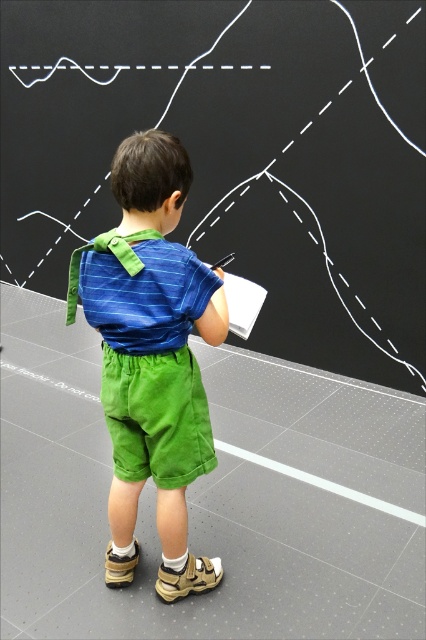
You are observing a classroom scene where two children are near the blackboard. You notice a blue striped shirt at center and a blue striped shirt at back. Which child is closer to you?

The blue striped shirt at center is closer to you because it has a larger size compared to the blue striped shirt at back, indicating it is nearer in the scene.

You are a teacher observing the child drawing on the blackboard. You notice two points marked on the board at coordinates point (146, 413) and point (138, 419). Which point is closer to the child?

Point (146, 413) is in front of point (138, 419), so it is closer to the child.